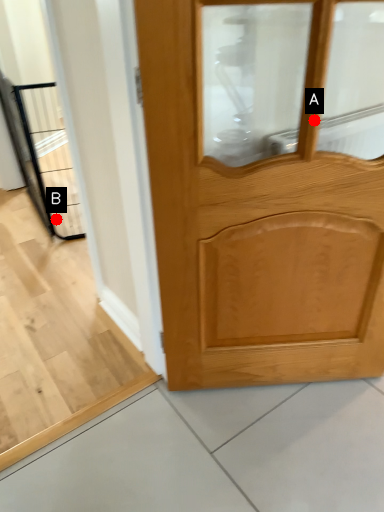
Question: Two points are circled on the image, labeled by A and B beside each circle. Which of the following is the closest to the observer?

Choices:
 (A) A is closer
 (B) B is closer

Answer: (A)